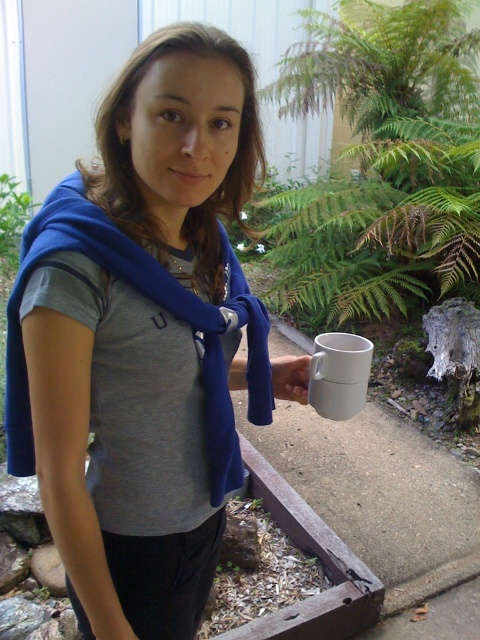
Is point (73, 180) positioned after point (290, 396)?

That is False.

Does blue fleece scarf at left have a lesser width compared to white matte cup at center?

No, blue fleece scarf at left is not thinner than white matte cup at center.

Who is more forward, (66, 212) or (291, 372)?

Positioned in front is point (66, 212).

The image size is (480, 640). I want to click on blue fleece scarf at left, so click(158, 305).

Is white matte mug at lower right to the right of white matte cup at center from the viewer's perspective?

Yes, white matte mug at lower right is to the right of white matte cup at center.

I want to click on white matte mug at lower right, so click(338, 374).

Who is taller, blue fabric scarf at upper left or white matte mug at lower right?

blue fabric scarf at upper left is taller.

Between blue fabric scarf at upper left and white matte mug at lower right, which one is positioned lower?

blue fabric scarf at upper left is lower down.

Which is in front, point (191, 145) or point (323, 337)?

Point (191, 145)

Where is `blue fabric scarf at upper left`? The image size is (480, 640). blue fabric scarf at upper left is located at coordinates (143, 339).